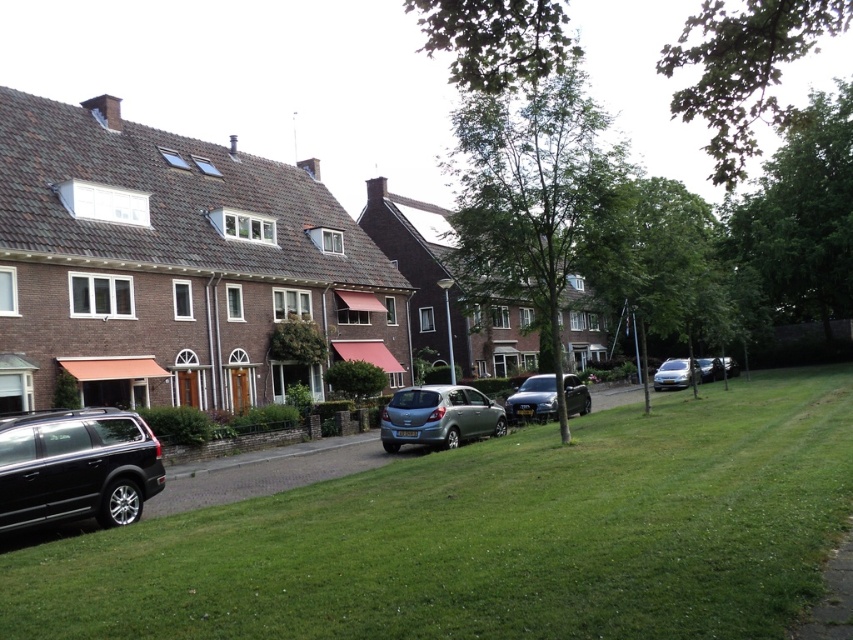
Based on the photo, measure the distance between point (405,499) and camera.

Point (405,499) and camera are 35.55 feet apart.

Describe the element at coordinates (492, 536) in the screenshot. This screenshot has height=640, width=853. I see `green grass lawn at lower center` at that location.

Where is `green grass lawn at lower center`? green grass lawn at lower center is located at coordinates (492, 536).

Does green grass lawn at lower center have a lesser width compared to shiny black suv at lower left?

In fact, green grass lawn at lower center might be wider than shiny black suv at lower left.

Where is `green grass lawn at lower center`? The height and width of the screenshot is (640, 853). green grass lawn at lower center is located at coordinates (492, 536).

Can you confirm if shiny black suv at lower left is shorter than satin silver hatchback at center?

Indeed, shiny black suv at lower left has a lesser height compared to satin silver hatchback at center.

This screenshot has height=640, width=853. Find the location of `shiny black suv at lower left`. shiny black suv at lower left is located at coordinates (76, 467).